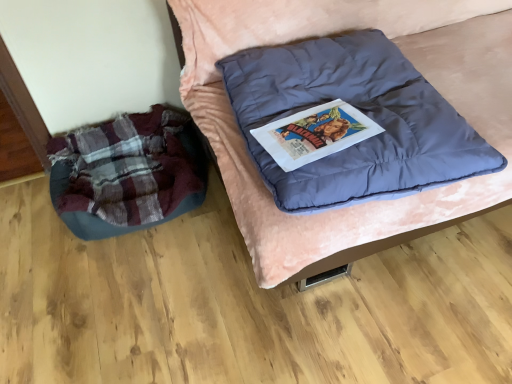
Image resolution: width=512 pixels, height=384 pixels. Find the location of `free space in front of plaid fabric bean bag at left`. free space in front of plaid fabric bean bag at left is located at coordinates 122,288.